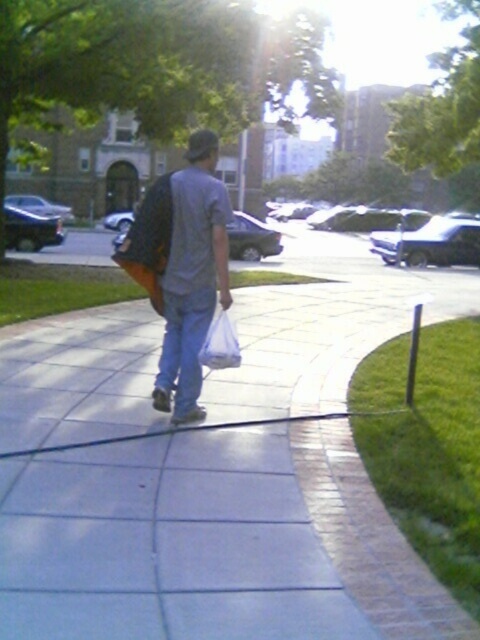
Is point (82, 481) closer to viewer compared to point (222, 316)?

That is True.

Image resolution: width=480 pixels, height=640 pixels. In order to click on white concrete sidewalk at center in this screenshot , I will do `click(212, 541)`.

Between matte gray shirt at center and white plastic bag at center, which one has less height?

white plastic bag at center

Between matte gray shirt at center and white plastic bag at center, which one appears on the left side from the viewer's perspective?

From the viewer's perspective, matte gray shirt at center appears more on the left side.

Which is in front, point (212, 269) or point (206, 344)?

Point (206, 344)

Where is `matte gray shirt at center`? matte gray shirt at center is located at coordinates (181, 268).

Does white concrete sidewalk at center appear on the left side of matte gray shirt at center?

Incorrect, white concrete sidewalk at center is not on the left side of matte gray shirt at center.

Can you confirm if white concrete sidewalk at center is bigger than matte gray shirt at center?

Indeed, white concrete sidewalk at center has a larger size compared to matte gray shirt at center.

Is point (85, 490) farther from camera compared to point (208, 298)?

No.

The height and width of the screenshot is (640, 480). In order to click on white concrete sidewalk at center in this screenshot , I will do `click(212, 541)`.